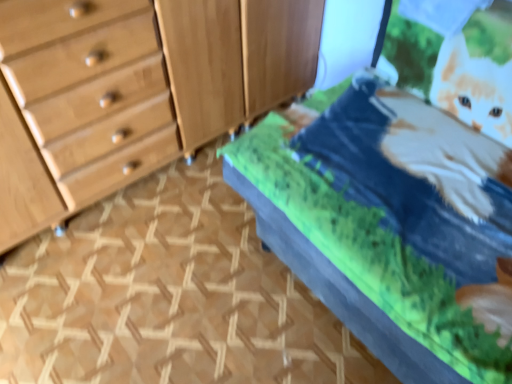
Question: Does light brown wood dresser at left have a greater height compared to wooden cabinet at center?

Choices:
 (A) no
 (B) yes

Answer: (B)

Question: Is light brown wood dresser at left not within wooden cabinet at center?

Choices:
 (A) no
 (B) yes

Answer: (B)

Question: Could you tell me if light brown wood dresser at left is facing wooden cabinet at center?

Choices:
 (A) no
 (B) yes

Answer: (A)

Question: Is light brown wood dresser at left to the right of wooden cabinet at center from the viewer's perspective?

Choices:
 (A) no
 (B) yes

Answer: (A)

Question: Is light brown wood dresser at left thinner than wooden cabinet at center?

Choices:
 (A) yes
 (B) no

Answer: (B)

Question: From the image's perspective, is light brown wood dresser at left positioned above or below velvet green bed at center?

Choices:
 (A) below
 (B) above

Answer: (B)

Question: In terms of width, does light brown wood dresser at left look wider or thinner when compared to velvet green bed at center?

Choices:
 (A) wide
 (B) thin

Answer: (B)

Question: Is light brown wood dresser at left taller or shorter than velvet green bed at center?

Choices:
 (A) tall
 (B) short

Answer: (A)

Question: Does point (5, 218) appear closer or farther from the camera than point (344, 173)?

Choices:
 (A) closer
 (B) farther

Answer: (B)

Question: In terms of width, does velvet green bed at center look wider or thinner when compared to wooden cabinet at center?

Choices:
 (A) wide
 (B) thin

Answer: (A)

Question: Is velvet green bed at center bigger or smaller than wooden cabinet at center?

Choices:
 (A) big
 (B) small

Answer: (A)

Question: Is velvet green bed at center taller or shorter than wooden cabinet at center?

Choices:
 (A) short
 (B) tall

Answer: (B)

Question: Is velvet green bed at center spatially inside wooden cabinet at center, or outside of it?

Choices:
 (A) inside
 (B) outside

Answer: (B)

Question: In terms of width, does velvet green bed at center look wider or thinner when compared to light brown wood dresser at left?

Choices:
 (A) wide
 (B) thin

Answer: (A)

Question: Is point (402, 92) positioned closer to the camera than point (135, 102)?

Choices:
 (A) farther
 (B) closer

Answer: (A)